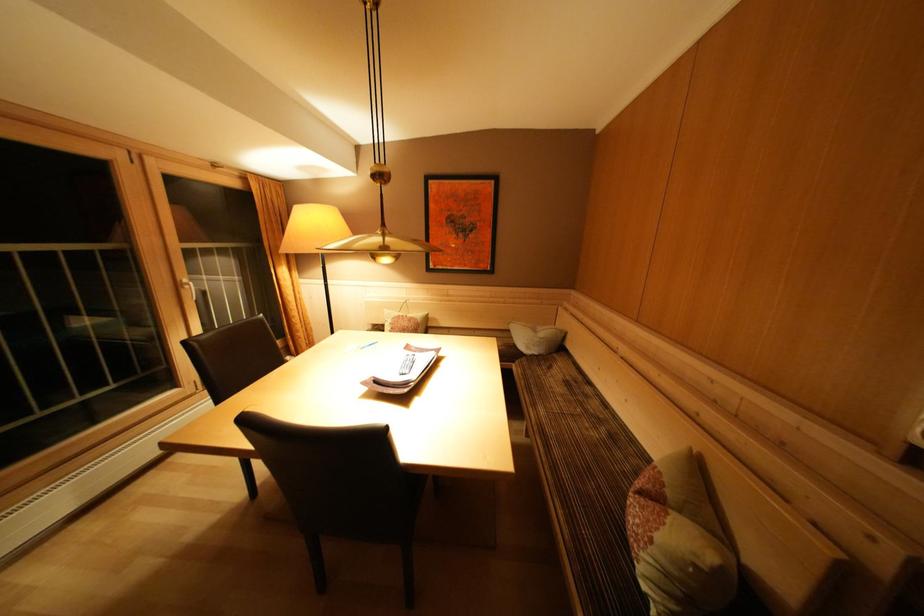
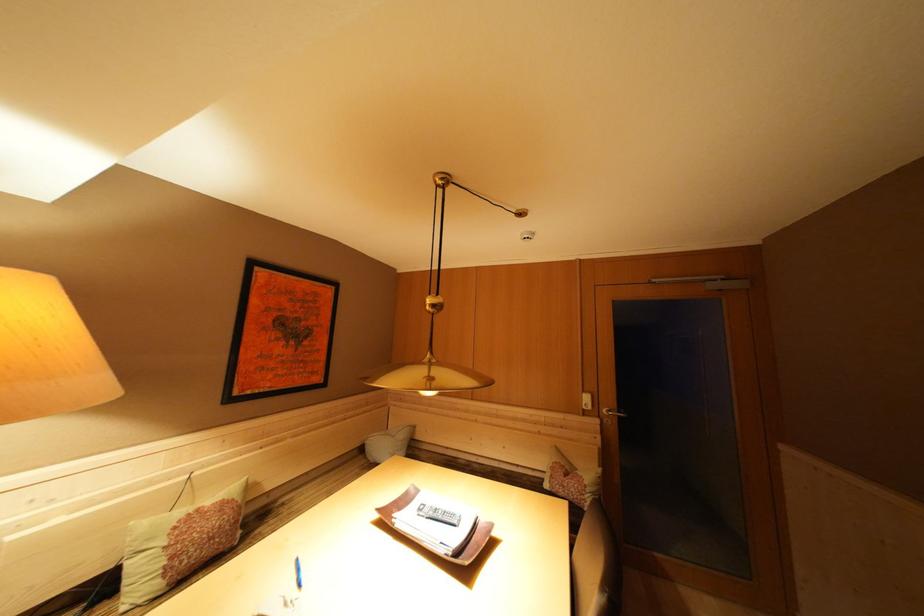
In the second image, find the point that corresponds to [665,543] in the first image.

(592, 487)